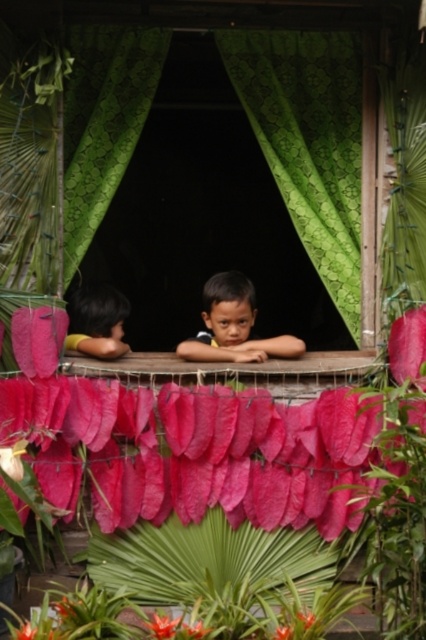
Question: Which point appears farthest from the camera in this image?

Choices:
 (A) (296, 352)
 (B) (293, 150)
 (C) (198, 628)

Answer: (B)

Question: Is orange matte flower at lower center thinner than green matte leaf at center?

Choices:
 (A) yes
 (B) no

Answer: (B)

Question: Which of the following is the closest to the observer?

Choices:
 (A) (247, 291)
 (B) (172, 636)

Answer: (B)

Question: Does orange matte flower at lower center appear under bright pink fabric at lower center?

Choices:
 (A) yes
 (B) no

Answer: (A)

Question: Observing the image, what is the correct spatial positioning of bright pink fabric at lower center in reference to green matte leaf at center?

Choices:
 (A) left
 (B) right

Answer: (B)

Question: Estimate the real-world distances between objects in this image. Which object is closer to the dark brown skin boy at center?

Choices:
 (A) bright pink petal at lower center
 (B) bright pink paper at center

Answer: (B)